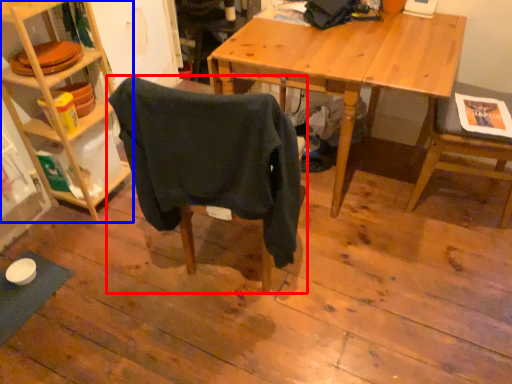
Question: Which object is closer to the camera taking this photo, chair (highlighted by a red box) or shelf (highlighted by a blue box)?

Choices:
 (A) chair
 (B) shelf

Answer: (A)